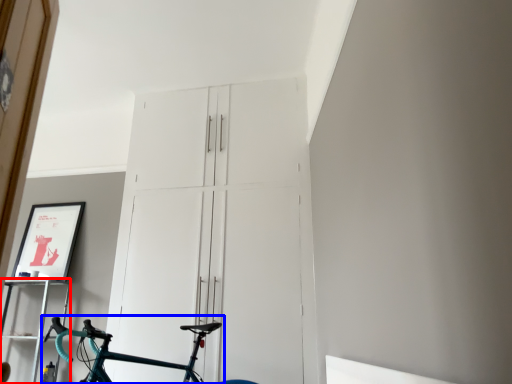
Question: Among these objects, which one is nearest to the camera, shelf (highlighted by a red box) or bicycle (highlighted by a blue box)?

Choices:
 (A) shelf
 (B) bicycle

Answer: (B)